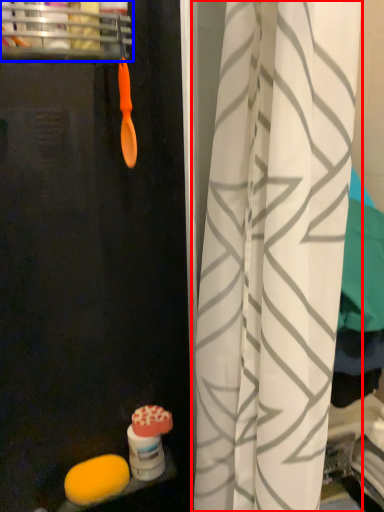
Question: Which point is further to the camera, curtain (highlighted by a red box) or shelf (highlighted by a blue box)?

Choices:
 (A) curtain
 (B) shelf

Answer: (B)